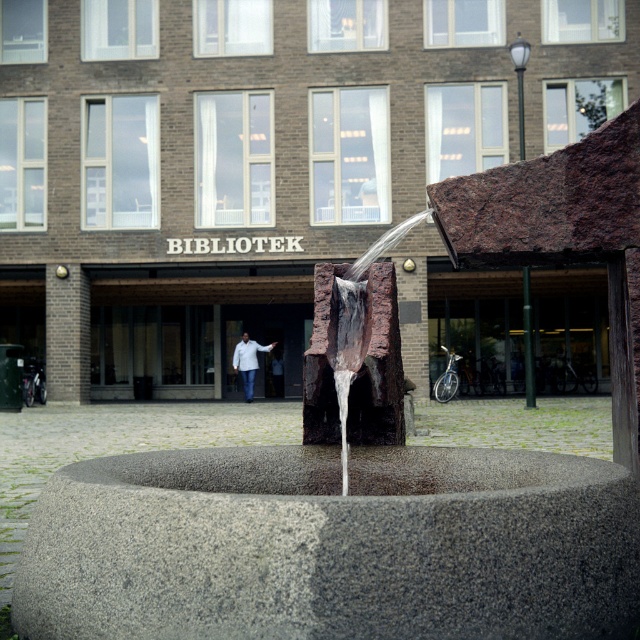
You are a photographer planning to capture both the rustic stone fountain at center and the white matte jacket at center in a single frame. Since you want to emphasize the fountain, where should you position yourself relative to the jacket to ensure the fountain appears bigger in the photo?

To make the rustic stone fountain at center appear larger than the white matte jacket at center in the photo, you should position yourself closer to the rustic stone fountain at center. Since it is already larger, moving closer will enhance its prominence in the frame.

You are standing at the entrance of the BIBLIOTEK building and want to locate the gray granite water at center. According to the coordinates provided, where should you look relative to the building?

The gray granite water at center is located at coordinates point (332,545), which means it is positioned to the right and slightly below the center point of the image. Since you are at the entrance of the BIBLIOTEK building, you should look towards the right side and slightly downward from the center to find the gray granite water at center.